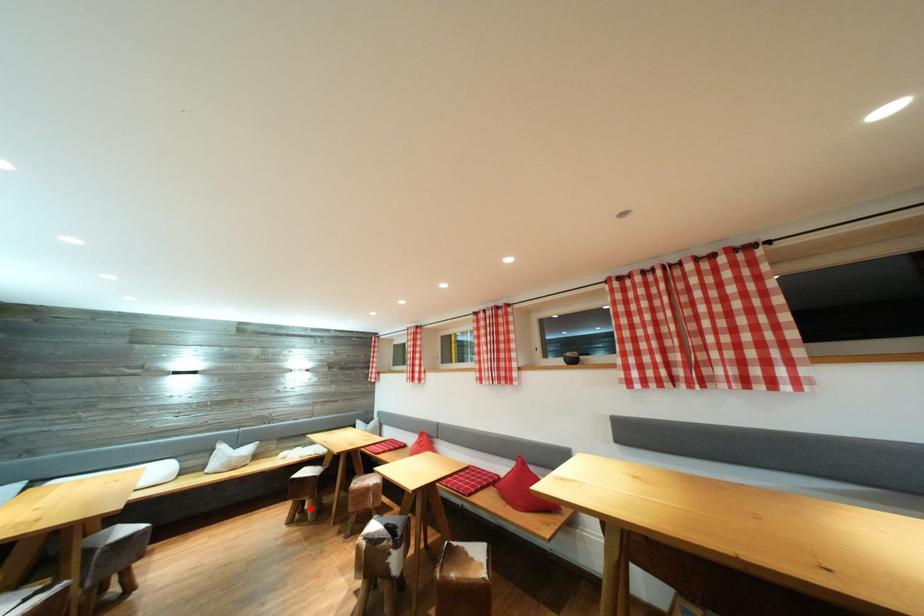
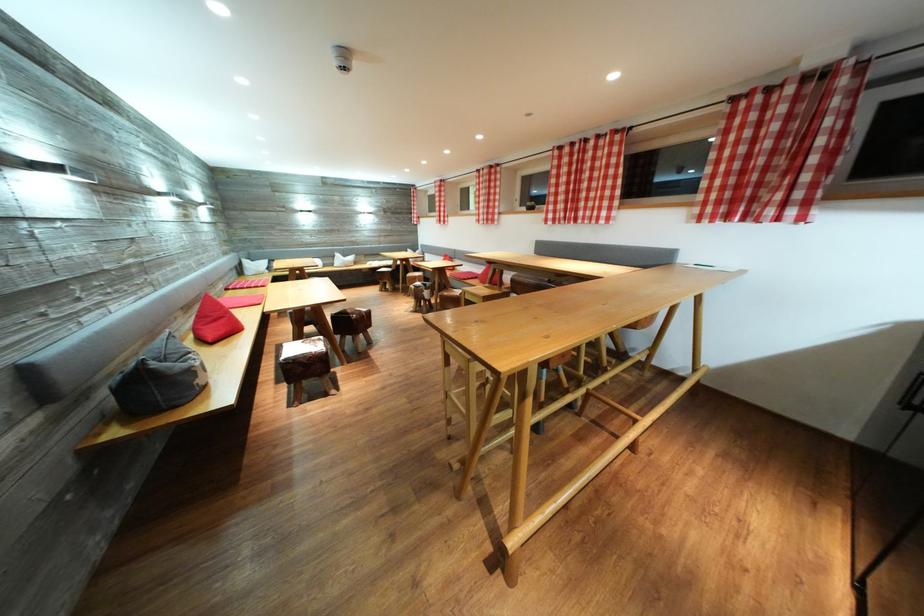
Question: I am providing you with two images of the same scene from different viewpoints. A red point is shown in image1. For the corresponding object point in image2, is it positioned nearer or farther from the camera?

Choices:
 (A) Nearer
 (B) Farther

Answer: (A)